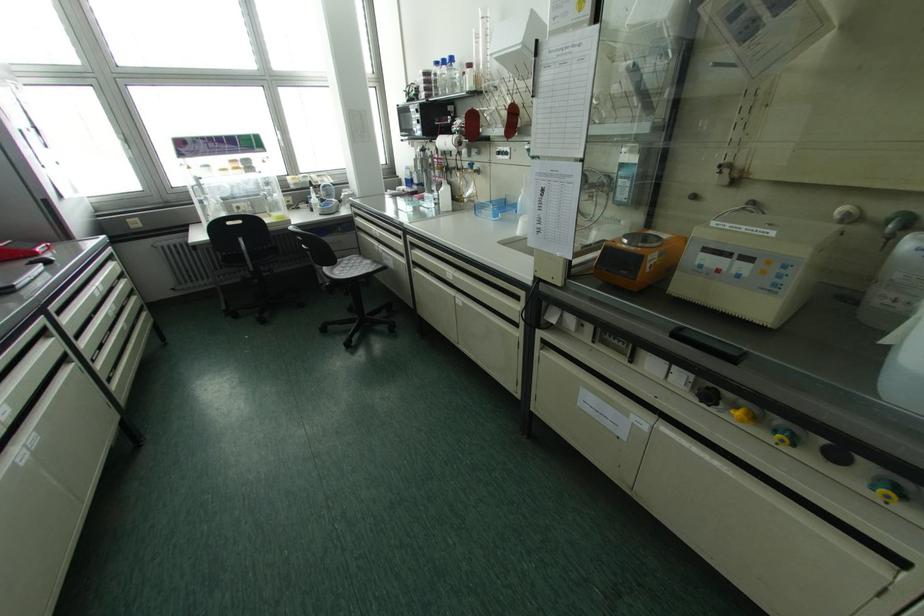
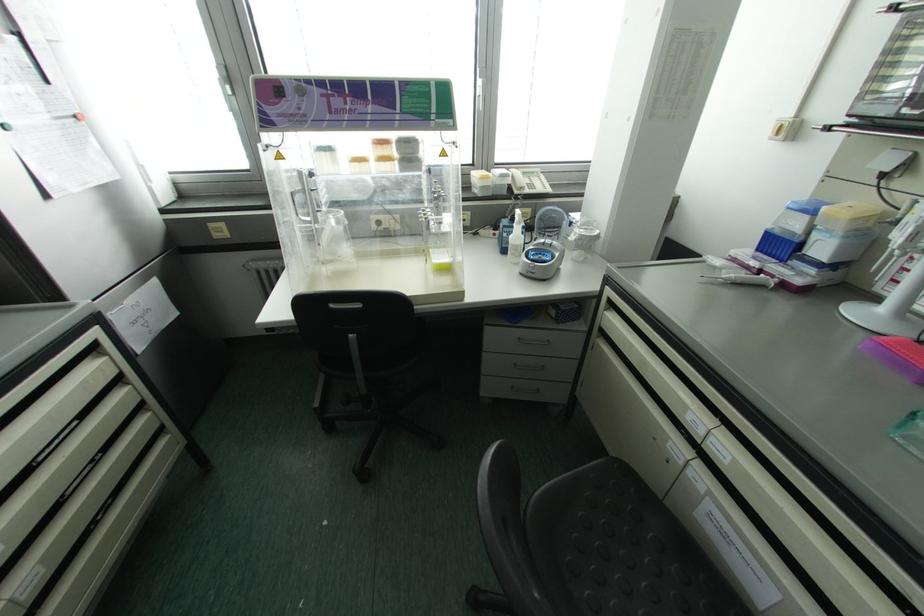
The point at [201,138] is marked in the first image. Where is the corresponding point in the second image?

(320, 82)